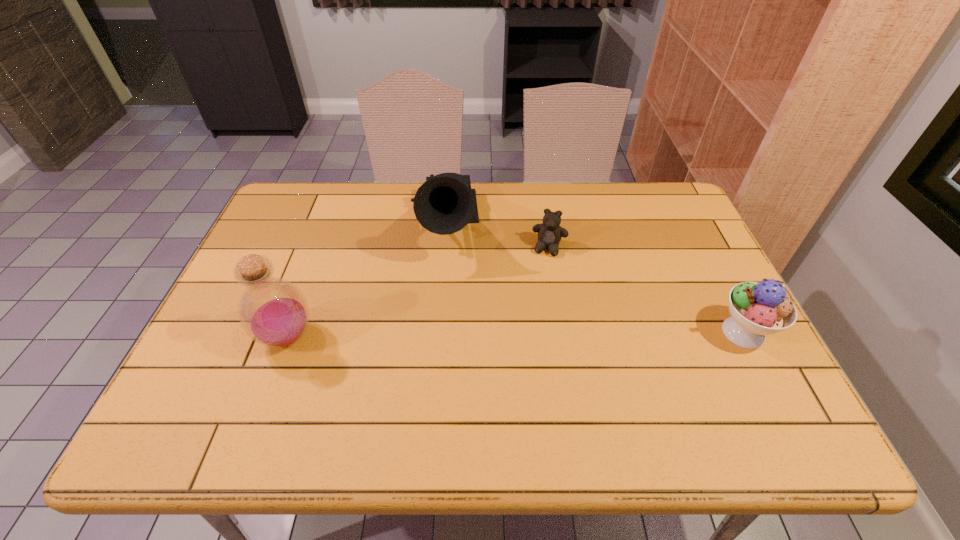
At what (x,y) coordinates should I click in order to perform the action: click on empty location between the teddy bear and the third object from right to left. Please return your answer as a coordinate pair (x, y). This screenshot has height=540, width=960. Looking at the image, I should click on (496, 237).

The image size is (960, 540). In order to click on free space between the shortest object and the phonograph_record in this screenshot , I will do `click(496, 237)`.

Locate which object is the third closest to the phonograph_record. Please provide its 2D coordinates. Your answer should be formatted as a tuple, i.e. [(x, y)], where the tuple contains the x and y coordinates of a point satisfying the conditions above.

[(758, 309)]

Locate which object is the third closest to the teddy bear. Please provide its 2D coordinates. Your answer should be formatted as a tuple, i.e. [(x, y)], where the tuple contains the x and y coordinates of a point satisfying the conditions above.

[(274, 312)]

The image size is (960, 540). I want to click on free spot that satisfies the following two spatial constraints: 1. on the front side of the teddy bear; 2. on the right side of the third tallest object, so click(x=563, y=333).

Identify the location of free space that satisfies the following two spatial constraints: 1. on the back side of the bottle; 2. on the right side of the second shortest object. This screenshot has width=960, height=540. (289, 333).